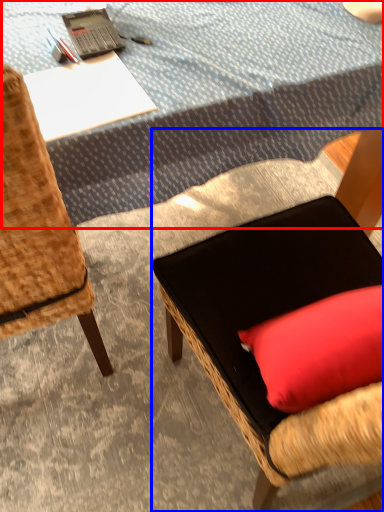
Question: Which object appears closest to the camera in this image, tablecloth (highlighted by a red box) or chair (highlighted by a blue box)?

Choices:
 (A) tablecloth
 (B) chair

Answer: (B)